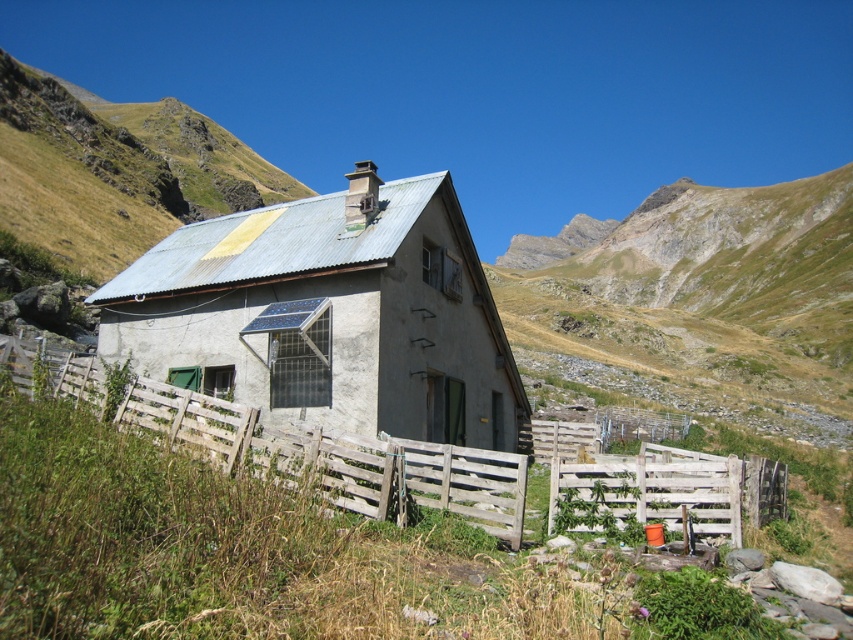
Question: Which point is closer to the camera taking this photo?

Choices:
 (A) (605, 497)
 (B) (326, 364)

Answer: (A)

Question: Which point is closer to the camera taking this photo?

Choices:
 (A) (216, 444)
 (B) (392, 342)

Answer: (A)

Question: Considering the relative positions of rusty metal cottage at center and wooden at center in the image provided, where is rusty metal cottage at center located with respect to wooden at center?

Choices:
 (A) left
 (B) right

Answer: (A)

Question: Does rusty metal cottage at center have a lesser width compared to wooden at center?

Choices:
 (A) no
 (B) yes

Answer: (A)

Question: Can you confirm if rusty metal cottage at center is wider than wooden at center?

Choices:
 (A) no
 (B) yes

Answer: (B)